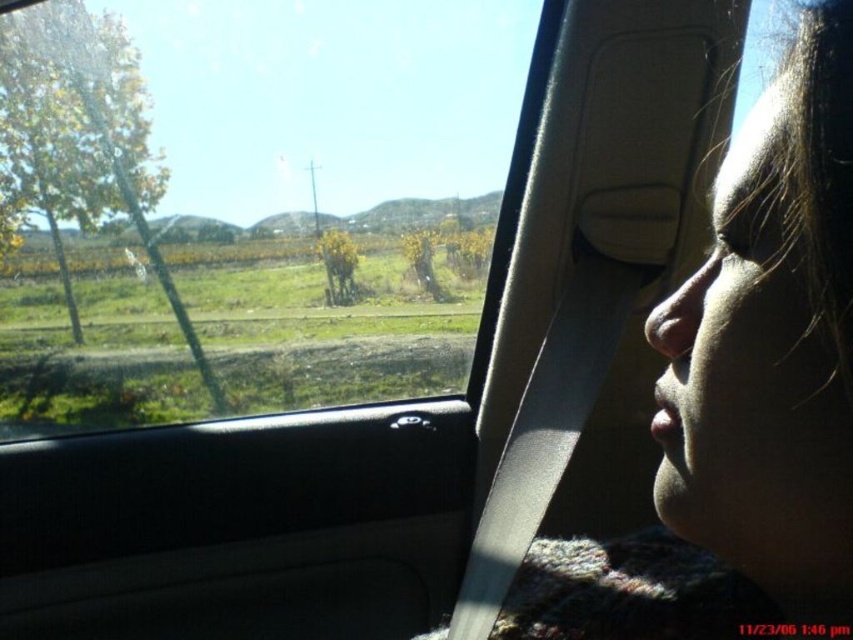
You are driving and looking out the passenger window. You notice two points marked on the window. The first point is at coordinates point (251, 262) and the second is at point (126, 250). Based on their positions, which point is closer to you?

Point (126, 250) is closer to you because it is in front of point (251, 262).

You are a passenger in a car and looking at the window. You notice a face reflected in the window. Where exactly is the smooth skin face at upper right located on the window?

The smooth skin face at upper right is located at point coordinates of 0.623 on the x axis and 0.871 on the y axis.

Looking at this image, you are sitting in the driver seat of the car and want to observe the white fluffy bird at left through the transparent glass car window at center. Can you see the bird through the window?

The transparent glass car window at center is positioned on the right side of white fluffy bird at left, so the window is to the right of the bird. Since you are in the driver seat, you would need to look to your left to see the bird, but the window is on the right side of the bird, meaning the window is not directly between you and the bird. Therefore, you might not be able to see the bird through the window unless you adjust your position or angle.